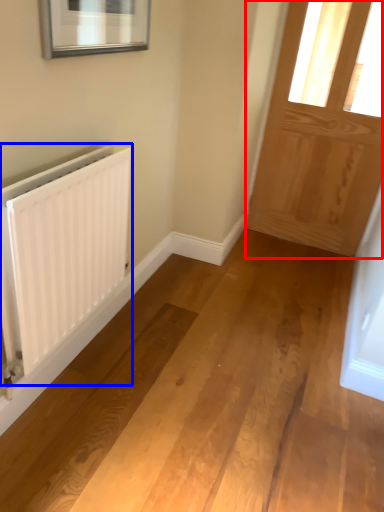
Question: Among these objects, which one is nearest to the camera, door (highlighted by a red box) or radiator (highlighted by a blue box)?

Choices:
 (A) door
 (B) radiator

Answer: (B)